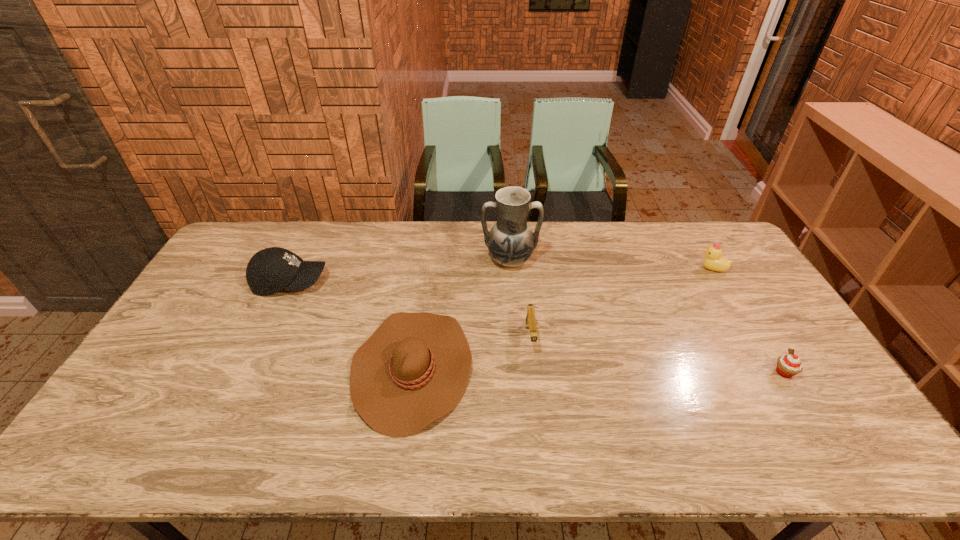
Where is `vacant space that satisfies the following two spatial constraints: 1. at the barrel of the pistol; 2. on the right side of the cupcake`? vacant space that satisfies the following two spatial constraints: 1. at the barrel of the pistol; 2. on the right side of the cupcake is located at coordinates (534, 372).

Locate an element on the screen. free space that satisfies the following two spatial constraints: 1. at the barrel of the pistol; 2. on the left side of the cupcake is located at coordinates (534, 372).

Locate an element on the screen. This screenshot has height=540, width=960. vacant position in the image that satisfies the following two spatial constraints: 1. on the front-facing side of the cowboy hat; 2. on the left side of the second tallest object is located at coordinates (251, 368).

You are a GUI agent. You are given a task and a screenshot of the screen. Output one action in this format:
    pyautogui.click(x=<x>, y=<y>)
    Task: Click on the vacant space that satisfies the following two spatial constraints: 1. on the front-facing side of the pitcher; 2. on the front-facing side of the fifth shortest object
    This screenshot has height=540, width=960.
    Given the screenshot: What is the action you would take?
    pyautogui.click(x=512, y=282)

Find the location of a particular element. The width and height of the screenshot is (960, 540). free spot that satisfies the following two spatial constraints: 1. on the front-facing side of the second tallest object; 2. on the right side of the cupcake is located at coordinates (248, 372).

The height and width of the screenshot is (540, 960). I want to click on vacant area that satisfies the following two spatial constraints: 1. on the back side of the cupcake; 2. on the front-facing side of the duckling, so click(720, 269).

The height and width of the screenshot is (540, 960). Find the location of `vacant region that satisfies the following two spatial constraints: 1. on the front-facing side of the baseball cap; 2. on the back side of the cupcake`. vacant region that satisfies the following two spatial constraints: 1. on the front-facing side of the baseball cap; 2. on the back side of the cupcake is located at coordinates (248, 372).